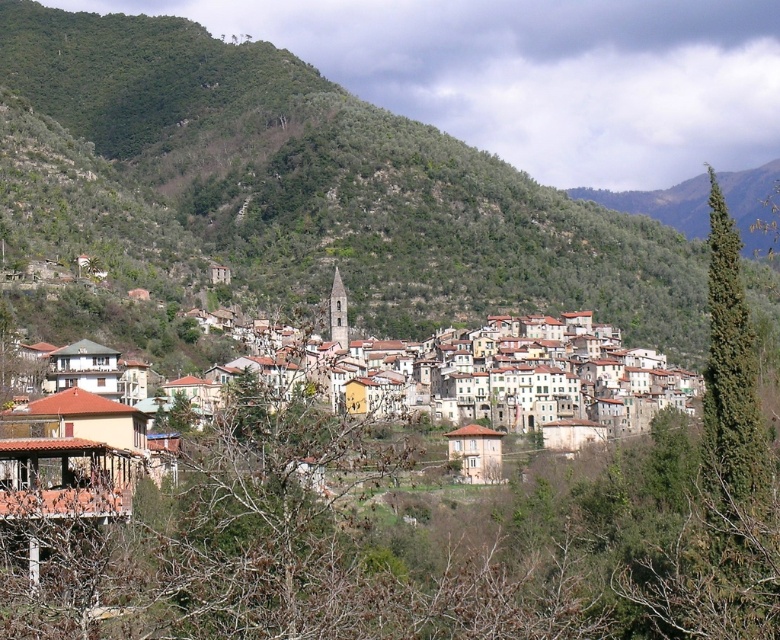
Is green leafy hillside at center below green coniferous tree at right?

No.

From the picture: Does green leafy hillside at center lie behind green coniferous tree at right?

Yes, green leafy hillside at center is further from the viewer.

Between point (140, 163) and point (736, 515), which one is positioned in front?

Positioned in front is point (736, 515).

At what (x,y) coordinates should I click in order to perform the action: click on green leafy hillside at center. Please return your answer as a coordinate pair (x, y). The image size is (780, 640). Looking at the image, I should click on (342, 182).